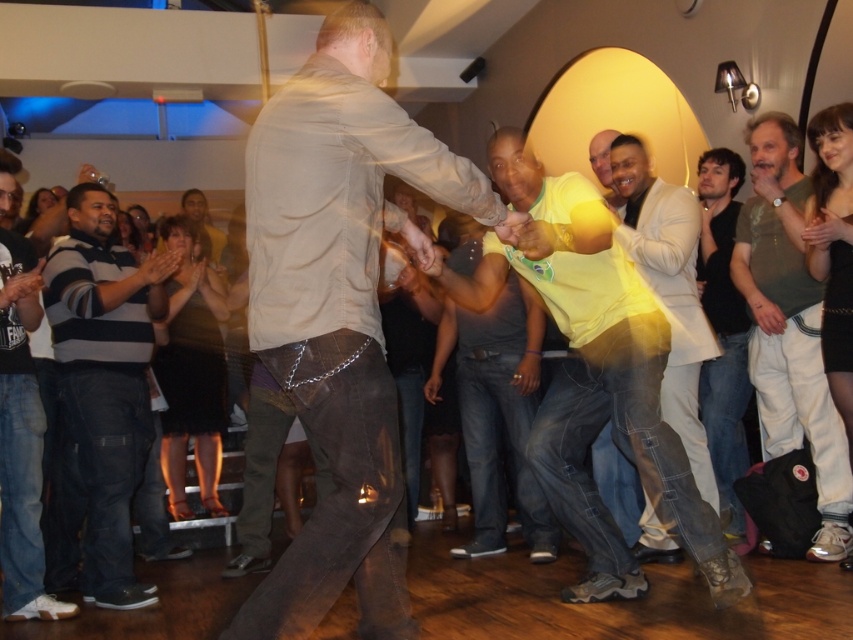
You are standing at the center of the room and want to move to the light brown leather pants at right. The room has a 3.5 meter wide doorway on the opposite wall. Can you walk straight to the pants without passing through the doorway?

The light brown leather pants at right are 3.27 meters away from you. Since the doorway is 3.5 meters wide, you can walk straight to the pants without passing through the doorway as the distance is shorter than the doorway width.

You are at a party and want to join the two people in the foreground. They are standing at point (556, 387). If you start from the arch wall, which direction should you walk to reach them?

Since the two people are at point (556, 387), you should walk towards the foreground to reach them from the arch wall in the background.